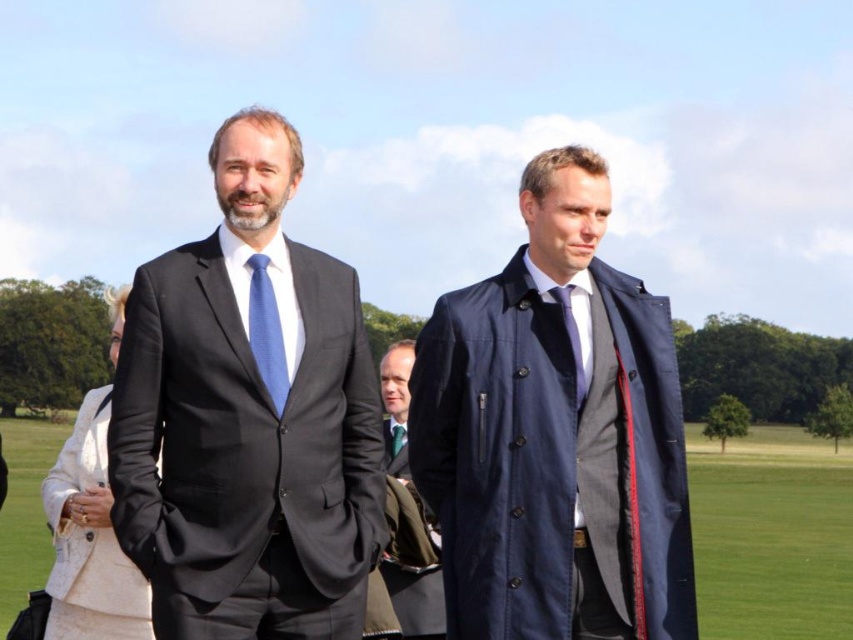
Question: Is white textured coat at left closer to camera compared to green silk tie at center?

Choices:
 (A) yes
 (B) no

Answer: (A)

Question: Is matte black suit at center below black matte suit at center?

Choices:
 (A) yes
 (B) no

Answer: (A)

Question: Can you confirm if matte black suit at center is positioned to the left of navy blue coat at center?

Choices:
 (A) yes
 (B) no

Answer: (A)

Question: Which point is farther to the camera?

Choices:
 (A) matte black suit at center
 (B) green grass at center
 (C) navy blue coat at center
 (D) white textured coat at left

Answer: (B)

Question: Which of these objects is positioned farthest from the green silk tie at center?

Choices:
 (A) white textured coat at left
 (B) navy blue coat at center
 (C) green grass at center

Answer: (C)

Question: Which of the following is the farthest from the observer?

Choices:
 (A) green silk tie at center
 (B) blue silk tie at center

Answer: (A)